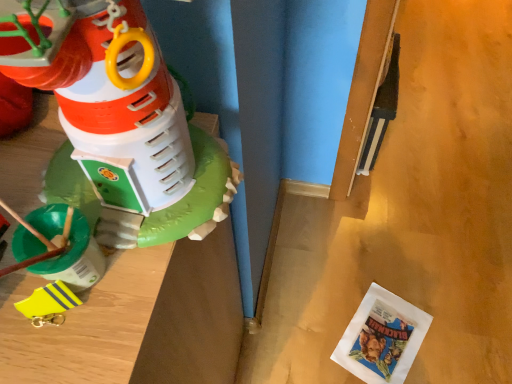
Question: Would you say white paper comic book at lower right contains matte plastic toy at left, which appears as the first toy when viewed from the front?

Choices:
 (A) yes
 (B) no

Answer: (B)

Question: Can you confirm if white paper comic book at lower right is thinner than matte plastic toy at left, which appears as the first toy when viewed from the front?

Choices:
 (A) yes
 (B) no

Answer: (B)

Question: Are white paper comic book at lower right and matte plastic toy at left, which appears as the first toy when viewed from the front, far apart?

Choices:
 (A) no
 (B) yes

Answer: (B)

Question: Does white paper comic book at lower right come behind matte plastic toy at left, the 2th toy viewed from the back?

Choices:
 (A) no
 (B) yes

Answer: (B)

Question: From the image's perspective, is white paper comic book at lower right located beneath matte plastic toy at left, which appears as the first toy when viewed from the front?

Choices:
 (A) yes
 (B) no

Answer: (A)

Question: From a real-world perspective, is white paper comic book at lower right on matte plastic toy at left, the 2th toy viewed from the back?

Choices:
 (A) no
 (B) yes

Answer: (A)

Question: Does white paper comic book at lower right have a lesser width compared to yellow rubber boot at left, the 2th toy when ordered from front to back?

Choices:
 (A) no
 (B) yes

Answer: (A)

Question: Does white paper comic book at lower right have a smaller size compared to yellow rubber boot at left, positioned as the second toy in top-to-bottom order?

Choices:
 (A) yes
 (B) no

Answer: (B)

Question: Does white paper comic book at lower right have a lesser height compared to yellow rubber boot at left, marked as the 1th toy in a bottom-to-top arrangement?

Choices:
 (A) no
 (B) yes

Answer: (B)

Question: Considering the relative sizes of white paper comic book at lower right and yellow rubber boot at left, marked as the 1th toy in a bottom-to-top arrangement, in the image provided, is white paper comic book at lower right wider than yellow rubber boot at left, marked as the 1th toy in a bottom-to-top arrangement,?

Choices:
 (A) no
 (B) yes

Answer: (B)

Question: From a real-world perspective, is white paper comic book at lower right on yellow rubber boot at left, the 2th toy when ordered from front to back?

Choices:
 (A) no
 (B) yes

Answer: (A)

Question: Is white paper comic book at lower right far away from yellow rubber boot at left, positioned as the second toy in top-to-bottom order?

Choices:
 (A) no
 (B) yes

Answer: (B)

Question: Can you confirm if yellow rubber boot at left, the 2th toy when ordered from front to back, is thinner than white paper comic book at lower right?

Choices:
 (A) yes
 (B) no

Answer: (A)